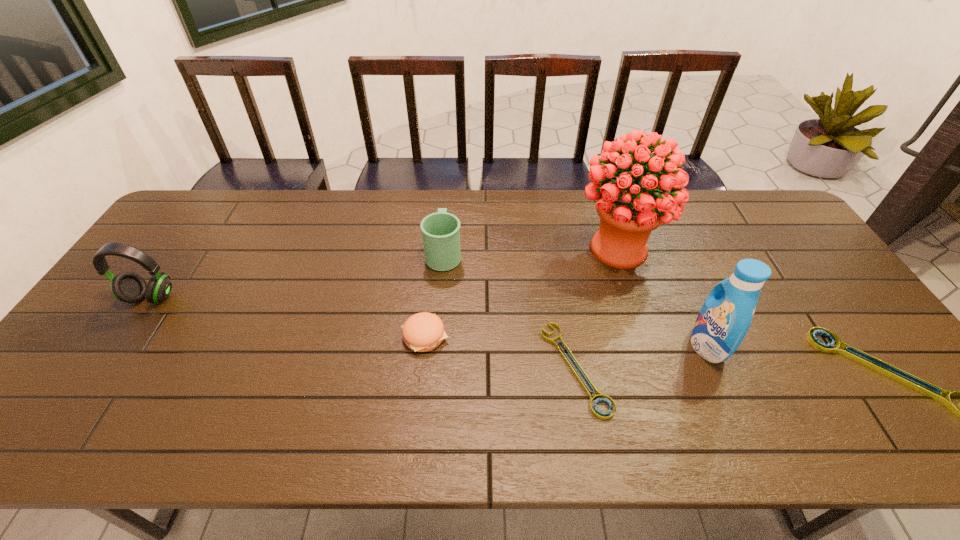
Where is `vacant space positioned 0.250m on the side of the mug with the handle`? vacant space positioned 0.250m on the side of the mug with the handle is located at coordinates (449, 191).

At what (x,y) coordinates should I click in order to perform the action: click on vacant space positioned on the side of the mug with the handle. Please return your answer as a coordinate pair (x, y). Looking at the image, I should click on (446, 220).

In order to click on vacant space located on the ear cups of the headset in this screenshot , I will do `click(124, 337)`.

Find the location of `free region located 0.240m on the right of the tallest object`. free region located 0.240m on the right of the tallest object is located at coordinates (739, 248).

Find the location of a particular element. vacant area situated 0.160m on the front-facing side of the detergent is located at coordinates (630, 346).

Find the location of a particular element. Image resolution: width=960 pixels, height=540 pixels. vacant space situated on the front-facing side of the detergent is located at coordinates (610, 346).

Identify the location of vacant space located 0.090m on the front-facing side of the detergent. This screenshot has width=960, height=540. (657, 346).

Find the location of a particular element. The height and width of the screenshot is (540, 960). vacant space situated on the back of the patty is located at coordinates pyautogui.click(x=434, y=254).

Find the location of `object that is at the far edge`. object that is at the far edge is located at coordinates (629, 212).

Locate an element on the screen. This screenshot has width=960, height=540. wrench that is at the near edge is located at coordinates (596, 412).